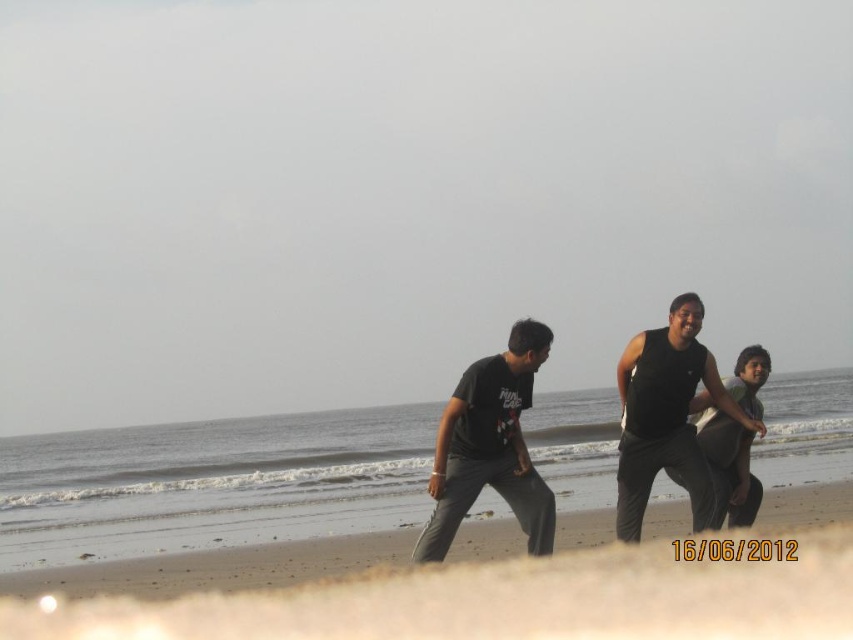
Which is behind, point (321, 602) or point (737, 410)?

The point (737, 410) is more distant.

This screenshot has height=640, width=853. Describe the element at coordinates (466, 586) in the screenshot. I see `brown sandy beach at lower center` at that location.

Image resolution: width=853 pixels, height=640 pixels. Identify the location of brown sandy beach at lower center. (466, 586).

Does black matte t-shirt at center have a greater width compared to dark gray jeans at center?

Indeed, black matte t-shirt at center has a greater width compared to dark gray jeans at center.

Between black matte t-shirt at center and dark gray jeans at center, which one has less height?

With less height is dark gray jeans at center.

Measure the distance between black matte t-shirt at center and camera.

black matte t-shirt at center is 33.79 feet away from camera.

In order to click on black matte t-shirt at center in this screenshot , I will do `click(490, 445)`.

Is the position of brown sandy beach at lower center more distant than that of black matte t-shirt at center?

That is False.

Which is in front, point (529, 593) or point (526, 371)?

Positioned in front is point (526, 371).

Locate an element on the screen. Image resolution: width=853 pixels, height=640 pixels. brown sandy beach at lower center is located at coordinates coord(466,586).